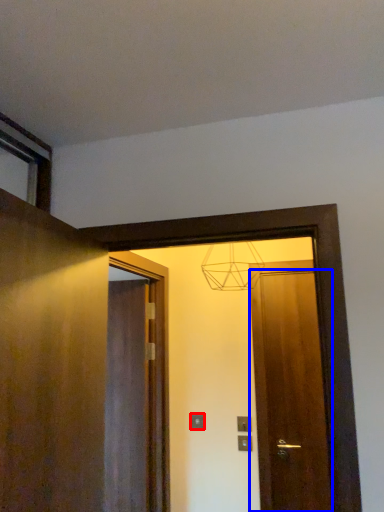
Question: Among these objects, which one is farthest to the camera, electric outlet (highlighted by a red box) or door (highlighted by a blue box)?

Choices:
 (A) electric outlet
 (B) door

Answer: (A)